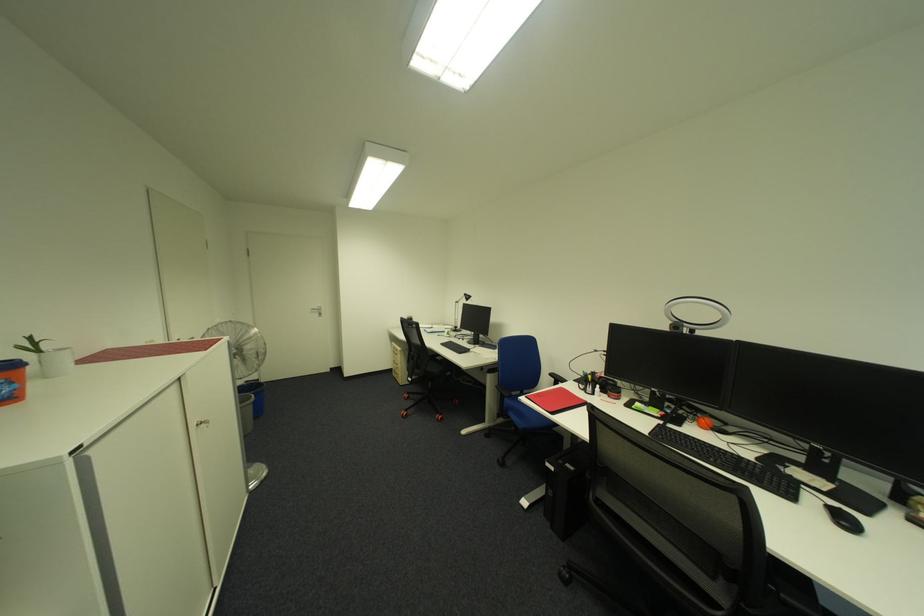
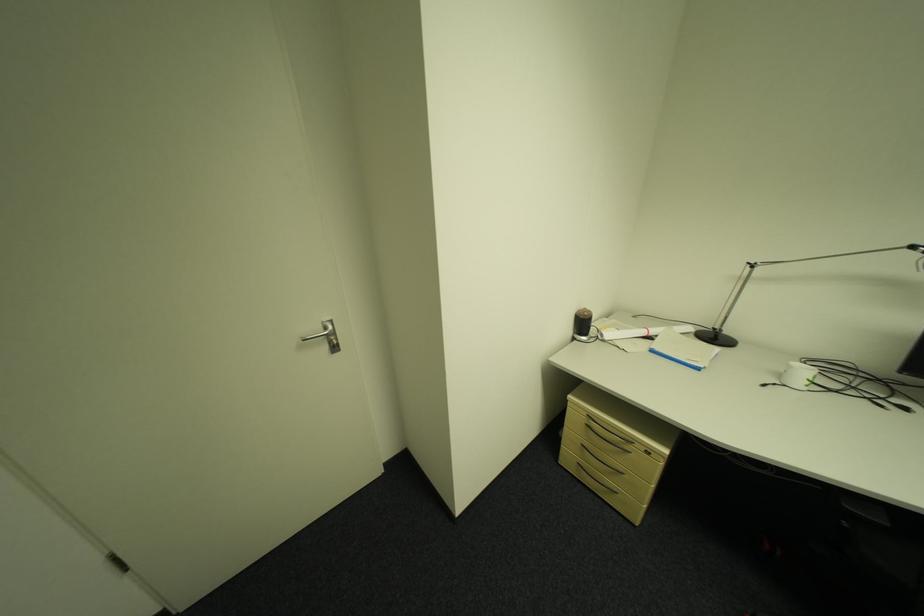
The point at (327, 315) is marked in the first image. Where is the corresponding point in the second image?

(335, 349)